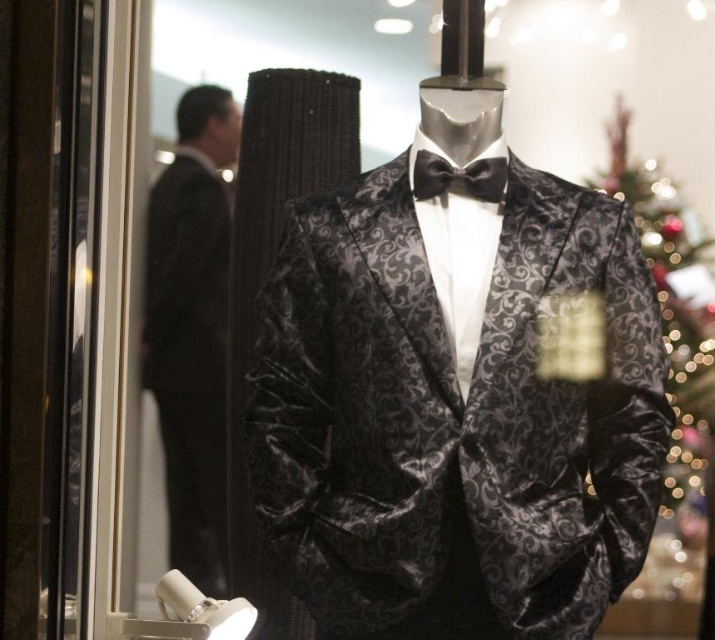
You are a tailor observing the mannequin in the store window. You need to adjust the black velvet suit at left and the black satin bow tie at center. Which item should you reach for first, the one closer to you or the one further away?

You should reach for the black velvet suit at left first because it is closer to you than the black satin bow tie at center.